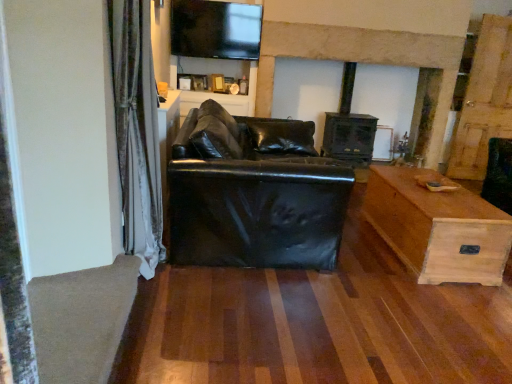
Find the location of a particular element. Image resolution: width=512 pixels, height=384 pixels. vacant space to the left of wooden chest at right is located at coordinates (349, 258).